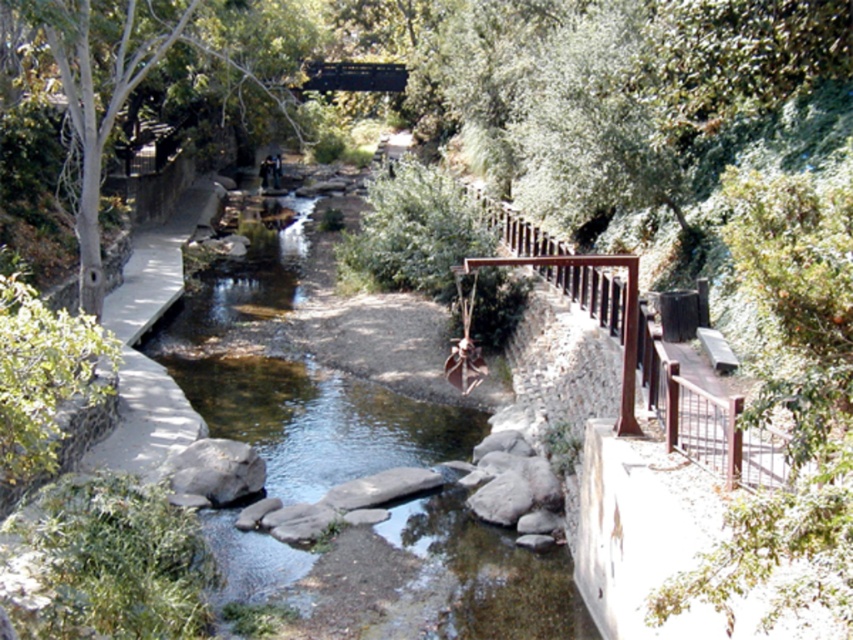
Consider the image. You are a painter setting up your easel to capture the scene of the green leafy tree at left and the metallic bridge at upper center. You want to ensure that both elements are visible in your painting. Given that the tree is narrower than the bridge, which object should you position closer to the center of your canvas to maintain balance?

Since the green leafy tree at left is narrower than the metallic bridge at upper center, you should position the metallic bridge at upper center closer to the center of your canvas to balance their sizes in the composition.

You are standing at the edge of the stream and want to reach the green leafy tree at left. Can you estimate how far you need to walk to get there?

The green leafy tree at left is 11.50 meters away from the viewer, so you need to walk approximately 11.50 meters to reach it.

From the picture: You are planning to install a new bench in the park. The bench requires a minimum of 30 feet of space between it and any nearby trees to avoid root interference. If you place the bench near the metallic bridge at upper center, will the green leafy tree at left comply with this requirement?

The green leafy tree at left and metallic bridge at upper center are 35.58 feet apart. Since the bench is placed near the metallic bridge at upper center, the distance between the bench and the green leafy tree at left is 35.58 feet, which exceeds the 30 feet requirement. Therefore, the bench placement complies with the root interference rule.